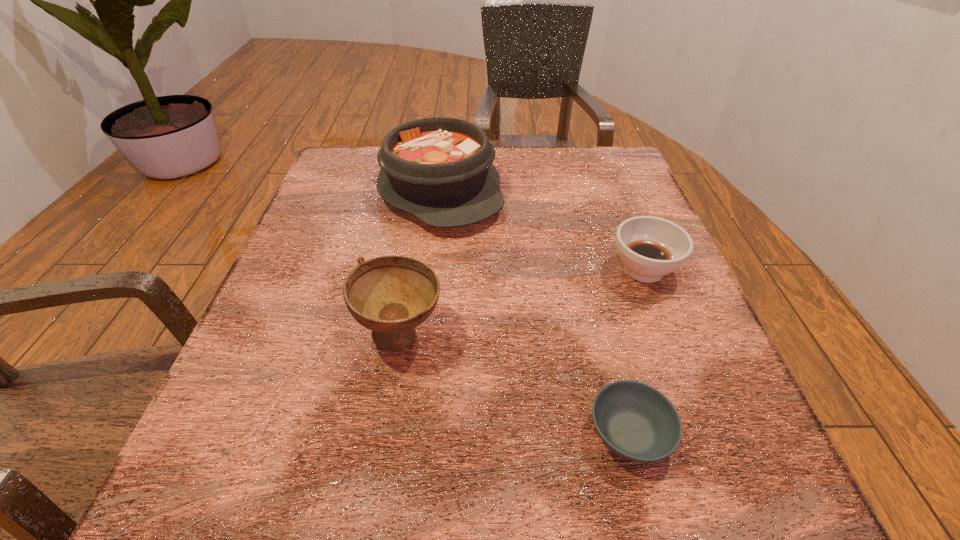
At what (x,y) coordinates should I click in order to perform the action: click on vacant space situated 0.210m on the back of the shortest soup bowl. Please return your answer as a coordinate pair (x, y). This screenshot has width=960, height=540. Looking at the image, I should click on (593, 292).

You are a GUI agent. You are given a task and a screenshot of the screen. Output one action in this format:
    pyautogui.click(x=<x>, y=<y>)
    Task: Click on the object that is at the far edge
    The image size is (960, 540).
    Given the screenshot: What is the action you would take?
    pyautogui.click(x=439, y=169)

Image resolution: width=960 pixels, height=540 pixels. I want to click on object at the near edge, so click(x=636, y=421).

The width and height of the screenshot is (960, 540). What are the coordinates of `object at the left edge` in the screenshot? It's located at (439, 169).

This screenshot has height=540, width=960. I want to click on object that is at the far left corner, so click(439, 169).

Find the location of a particular element. The image size is (960, 540). object at the near right corner is located at coordinates (636, 421).

Find the location of a particular element. This screenshot has height=540, width=960. free point at the far edge is located at coordinates (507, 168).

In the image, there is a desktop. Where is `vacant space at the near edge`? The height and width of the screenshot is (540, 960). vacant space at the near edge is located at coordinates point(549,469).

What are the coordinates of `vacant space at the left edge` in the screenshot? It's located at (319, 293).

Locate an element on the screen. This screenshot has height=540, width=960. free location at the right edge of the desktop is located at coordinates (581, 217).